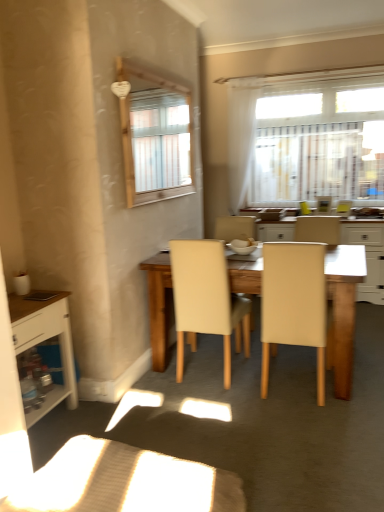
Question: From the image's perspective, is white wood cabinet at left positioned above or below white sheer curtain at upper center?

Choices:
 (A) above
 (B) below

Answer: (B)

Question: Is white wood cabinet at left wider or thinner than white sheer curtain at upper center?

Choices:
 (A) wide
 (B) thin

Answer: (A)

Question: Estimate the real-world distances between objects in this image. Which object is farther from the white glossy bowl at center?

Choices:
 (A) light beige leather table at center
 (B) white sheer curtain at upper center
 (C) white wood cabinet at left
 (D) beige leather chair at center, the first chair in the right-to-left sequence
 (E) wooden table at center

Answer: (B)

Question: Which object is positioned closest to the beige leather chair at center, which appears as the 2th chair when viewed from the right?

Choices:
 (A) white wood cabinet at left
 (B) white sheer curtain at upper center
 (C) white glossy bowl at center
 (D) light beige leather table at center
 (E) beige leather chair at center, the first chair in the right-to-left sequence

Answer: (E)